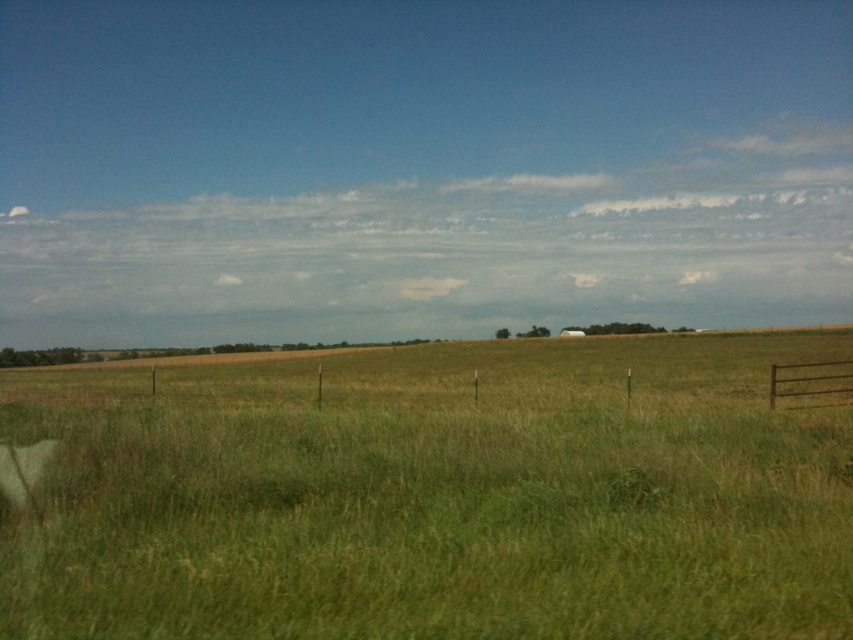
Is green grassy pasture at center shorter than rusty metal fence at right?

No.

Between point (550, 458) and point (844, 358), which one is positioned in front?

Point (550, 458)

You are a GUI agent. You are given a task and a screenshot of the screen. Output one action in this format:
    pyautogui.click(x=<x>, y=<y>)
    Task: Click on the green grassy pasture at center
    
    Given the screenshot: What is the action you would take?
    pyautogui.click(x=437, y=496)